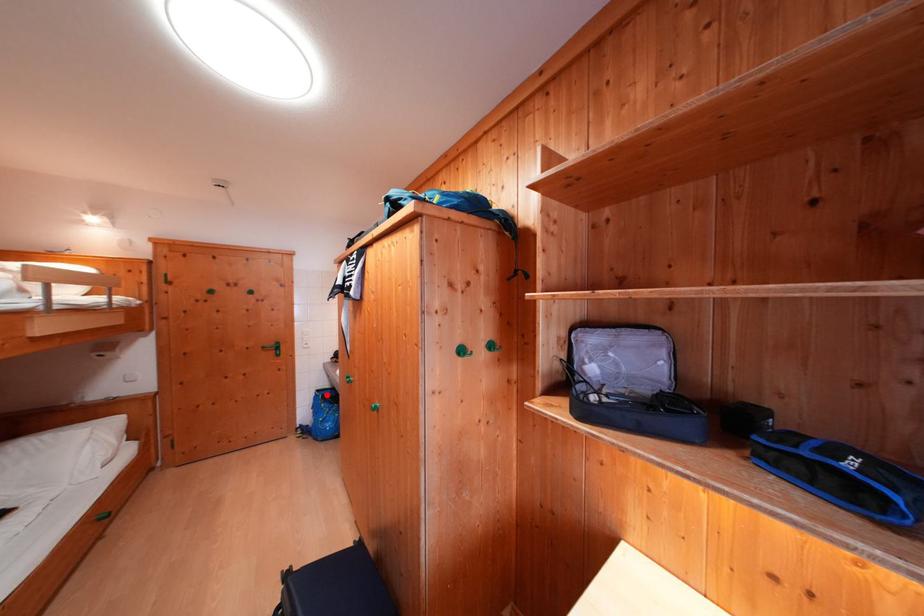
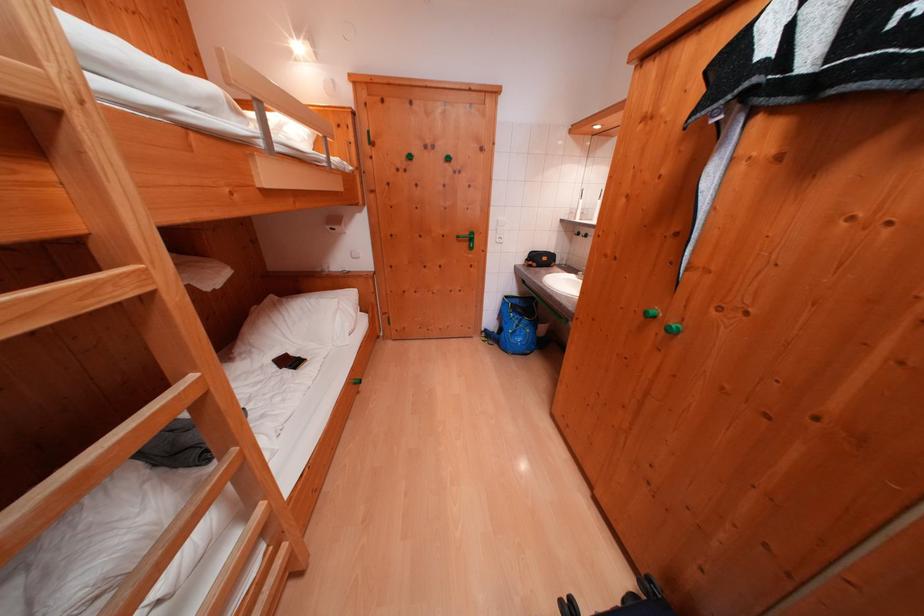
Where in the second image is the point corresponding to the highlighted location from the first image?

(515, 301)